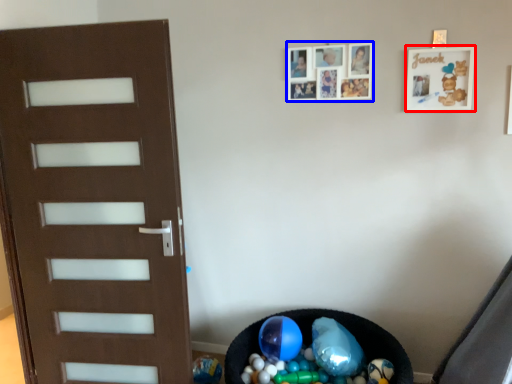
Question: Which object is closer to the camera taking this photo, picture frame (highlighted by a red box) or picture frame (highlighted by a blue box)?

Choices:
 (A) picture frame
 (B) picture frame

Answer: (A)